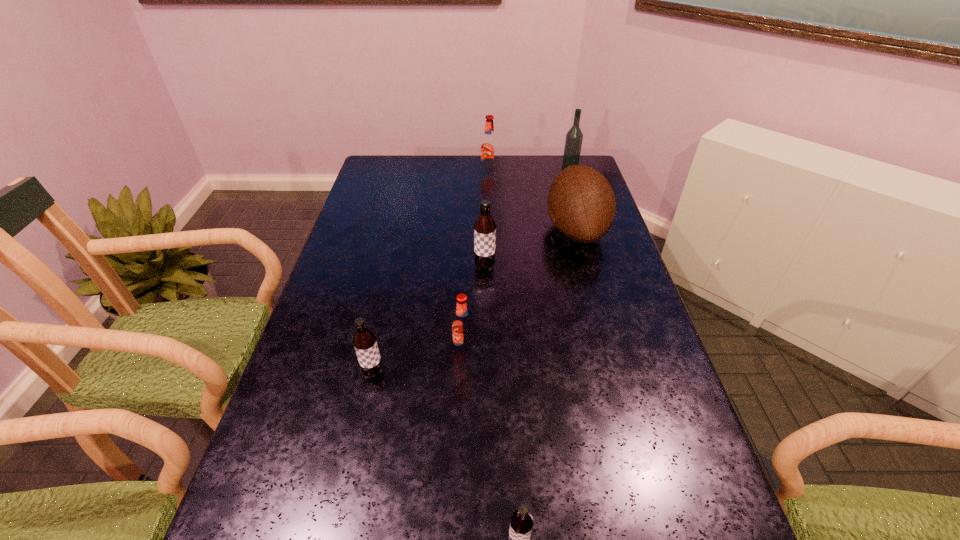
Where is `vodka`? This screenshot has height=540, width=960. vodka is located at coordinates [574, 137].

Find the location of a particular element. This screenshot has width=960, height=540. the farthest root beer is located at coordinates (489, 144).

Locate an element on the screen. This screenshot has height=540, width=960. the right red root beer is located at coordinates (489, 144).

This screenshot has height=540, width=960. Find the location of `the second brown root beer from right to left`. the second brown root beer from right to left is located at coordinates (484, 227).

In order to click on the fourth nearest root beer in this screenshot , I will do `click(484, 227)`.

I want to click on brown football, so click(581, 203).

In order to click on the smaller red root beer in this screenshot , I will do `click(462, 326)`.

Find the location of `the third farthest root beer`. the third farthest root beer is located at coordinates (462, 326).

At what (x,y) coordinates should I click in order to perform the action: click on the leftmost root beer. Please return your answer as a coordinate pair (x, y). Looking at the image, I should click on (364, 341).

Locate an element on the screen. the second nearest root beer is located at coordinates (364, 341).